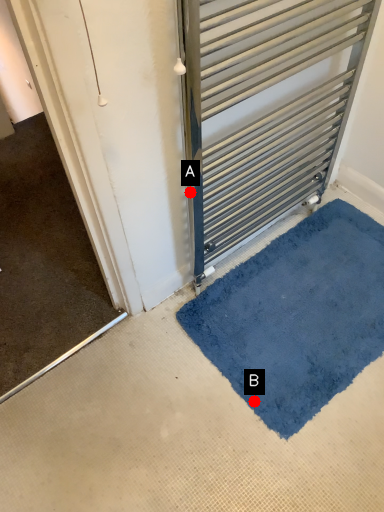
Question: Two points are circled on the image, labeled by A and B beside each circle. Which of the following is the farthest from the observer?

Choices:
 (A) A is further
 (B) B is further

Answer: (A)